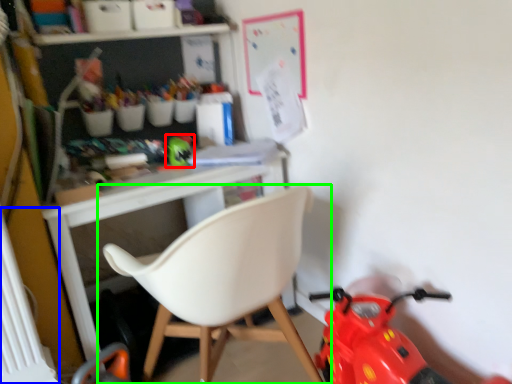
Question: Which object is positioned closest to toy (highlighted by a red box)? Select from radiator (highlighted by a blue box) and chair (highlighted by a green box).

Choices:
 (A) radiator
 (B) chair

Answer: (B)